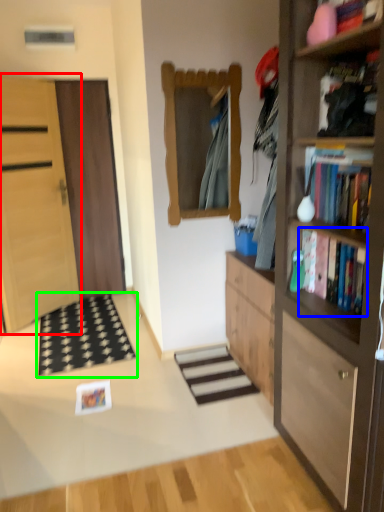
Question: Considering the real-world distances, which object is farthest from door (highlighted by a red box)? book (highlighted by a blue box) or doormat (highlighted by a green box)?

Choices:
 (A) book
 (B) doormat

Answer: (A)